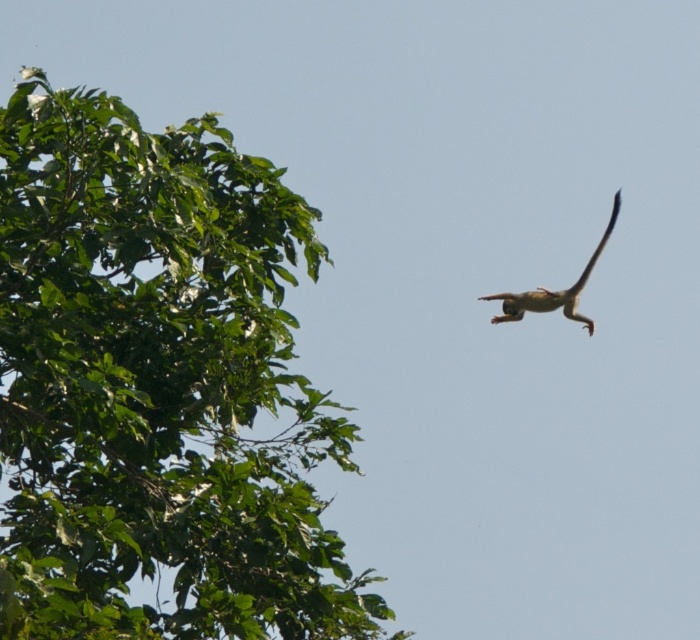
You are standing at the camera position and want to reach the point marked at coordinates (276, 340). If your walking speed is 3 feet per second, how many seconds will it take you to reach that point?

The point marked at coordinates (276, 340) is 47.85 feet away from the camera. At a walking speed of 3 feet per second, it would take 47.85 divided by 3, which equals approximately 15.95 seconds. Therefore, it will take about 16 seconds to reach the point.

You are a photographer standing in the middle of the scene. You want to capture a photo that includes both the green leafy tree at upper left and the brown furry monkey at upper right. What is the minimum distance you need to move backward to ensure both subjects are in frame?

The green leafy tree at upper left and brown furry monkey at upper right are 11.77 feet apart. To include both in the frame, you need to move backward until the distance between them fits within your camera lens field of view. However, without knowing the specific focal length and sensor size of your camera, it is impossible to calculate the exact distance. Generally, using a wider angle lens would allow capturing both subjects from a closer position.

You are an animal keeper in the zoo and need to place a feeding station between the green leafy tree at upper left and the brown furry monkey at upper right. Which side of the feeding station should be closer to the tree to ensure it is wider than the monkey?

The green leafy tree at upper left is wider than the brown furry monkey at upper right. Therefore, the side of the feeding station closer to the green leafy tree at upper left should be wider to accommodate its greater width.